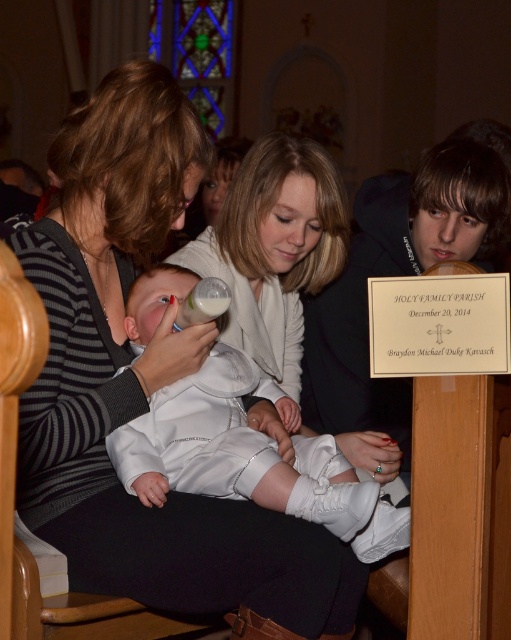
From the picture: You are a photographer taking a picture of the striped sweater at center and the white satin baby at center. Which object should you focus on first if you want to capture both in the frame without moving the camera?

The striped sweater at center is positioned on the left side of the white satin baby at center, so you should focus on the striped sweater at center first to ensure both are in the frame.

You are a photographer taking a picture of the striped sweater at center and the white satin baby at center. Which object is wider in the image?

The striped sweater at center is wider than the white satin baby at center.

You are a photographer at the baptism ceremony. You need to capture a closeup shot of both the white satin baby at center and the white plastic bottle at center. Since the bottle is smaller than the baby, how should you position your camera to ensure both are in focus?

The white satin baby at center is taller than the white plastic bottle at center. To ensure both are in focus, position the camera so that the bottle is closer to the lens while keeping the baby at a distance where its full height can be captured without blurring.